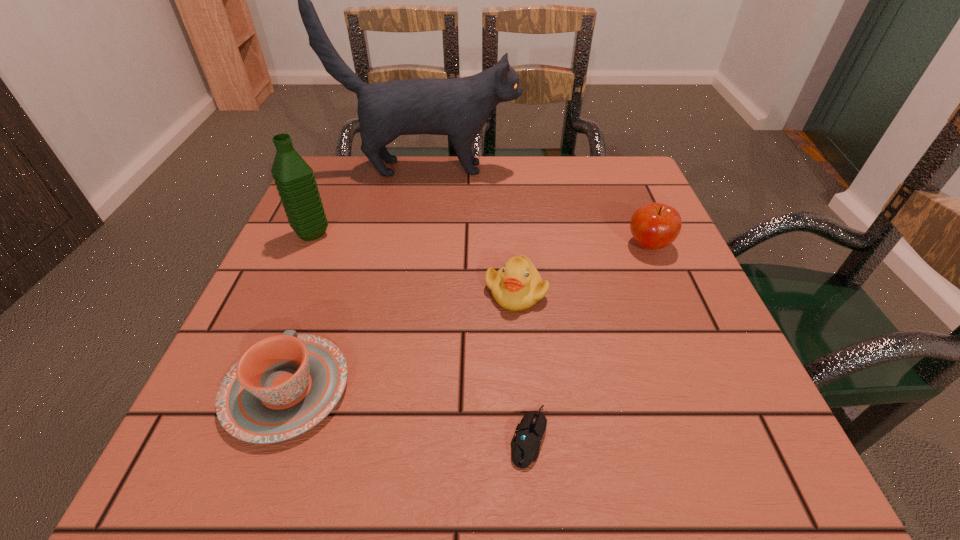
Find the location of `cat`. cat is located at coordinates [459, 107].

Where is `the tallest object`? Image resolution: width=960 pixels, height=540 pixels. the tallest object is located at coordinates (459, 107).

The width and height of the screenshot is (960, 540). I want to click on water bottle, so click(294, 178).

This screenshot has height=540, width=960. In order to click on the rightmost object in this screenshot , I will do `click(654, 226)`.

This screenshot has height=540, width=960. What are the coordinates of `the third nearest object` in the screenshot? It's located at [x=517, y=286].

What are the coordinates of `chinaware` in the screenshot? It's located at (284, 385).

Where is `computer mouse`? This screenshot has width=960, height=540. computer mouse is located at coordinates (525, 445).

Find the location of a particular element. Image resolution: width=960 pixels, height=540 pixels. vacant space located 0.140m at the face of the tallest object is located at coordinates (572, 168).

Image resolution: width=960 pixels, height=540 pixels. What are the coordinates of `free region located 0.240m on the back of the fifth shortest object` in the screenshot? It's located at (342, 166).

What are the coordinates of `free space located on the back of the rightmost object` in the screenshot? It's located at (623, 185).